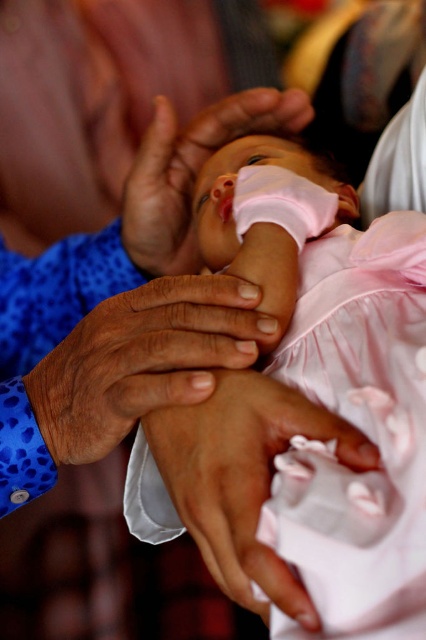
Question: Which object appears closest to the camera in this image?

Choices:
 (A) smooth skin hand at center
 (B) pink fabric at center
 (C) pink satin baby hand at center

Answer: (C)

Question: Can you confirm if smooth skin hand at center is smaller than pink satin baby hand at center?

Choices:
 (A) yes
 (B) no

Answer: (B)

Question: Which is farther from the smooth skin hand at center?

Choices:
 (A) pink fabric at center
 (B) pink satin baby hand at center

Answer: (A)

Question: Estimate the real-world distances between objects in this image. Which object is farther from the smooth skin hand at center?

Choices:
 (A) pink satin baby hand at center
 (B) pink fabric at center

Answer: (B)

Question: Where is pink satin baby hand at center located in relation to pink fabric at center in the image?

Choices:
 (A) right
 (B) left

Answer: (A)

Question: Is smooth skin hand at center above pink fabric at center?

Choices:
 (A) yes
 (B) no

Answer: (B)